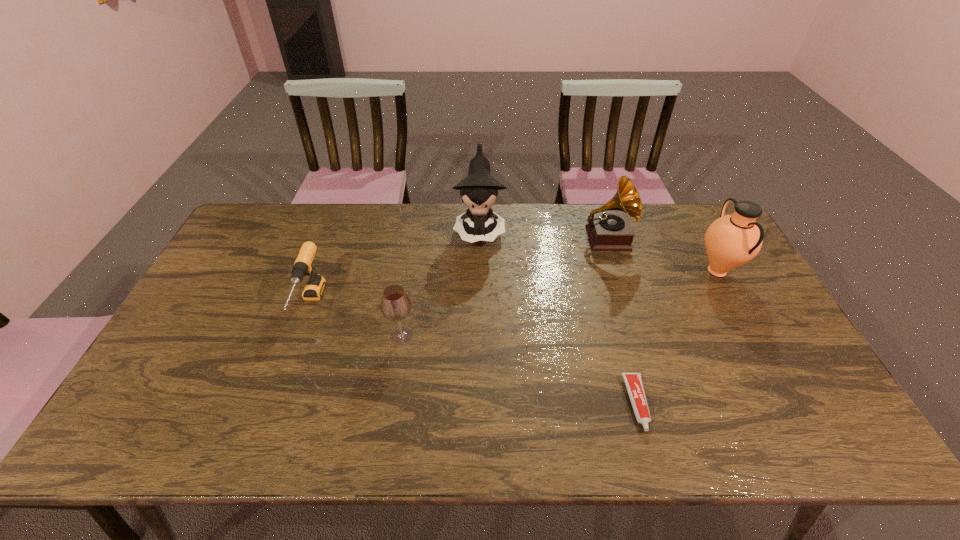
Locate an element on the screen. The image size is (960, 540). blank space located 0.370m on the left of the pitcher is located at coordinates (575, 271).

Locate an element on the screen. The height and width of the screenshot is (540, 960). vacant space situated 0.350m on the back of the wineglass is located at coordinates (417, 243).

The image size is (960, 540). Find the location of `vacant area located on the handle side of the second shortest object`. vacant area located on the handle side of the second shortest object is located at coordinates (279, 392).

Identify the location of doll that is at the far edge. The height and width of the screenshot is (540, 960). (479, 189).

Identify the location of phonograph record at the far edge. [606, 230].

Locate an element on the screen. Image resolution: width=960 pixels, height=540 pixels. object located in the near edge section of the desktop is located at coordinates (633, 382).

Where is `object that is at the right edge`? The image size is (960, 540). object that is at the right edge is located at coordinates (732, 240).

In the image, there is a desktop. In order to click on free space at the far edge in this screenshot , I will do `click(427, 226)`.

The image size is (960, 540). In the image, there is a desktop. Find the location of `vacant space at the near edge`. vacant space at the near edge is located at coordinates (412, 423).

The width and height of the screenshot is (960, 540). In the image, there is a desktop. Find the location of `free space at the left edge`. free space at the left edge is located at coordinates pos(218,308).